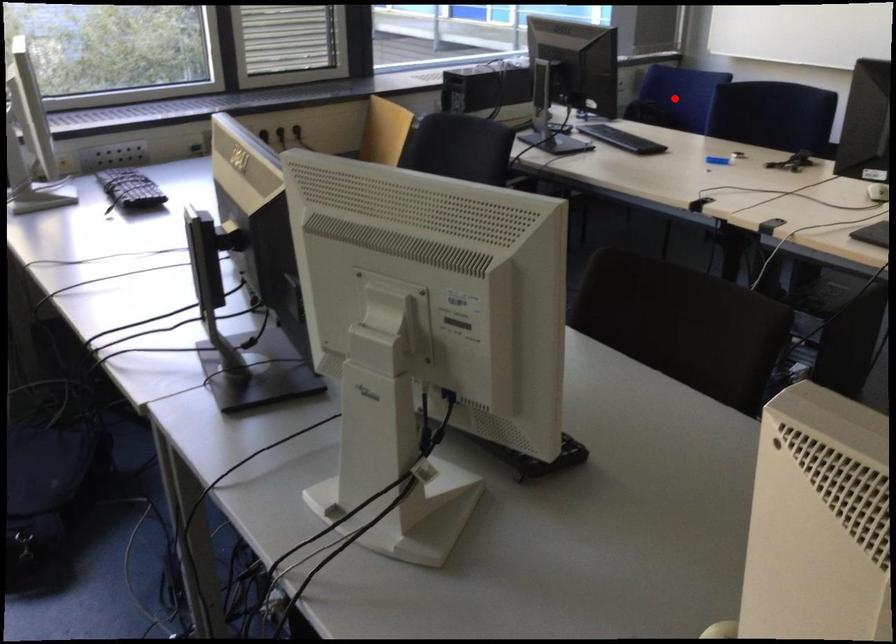
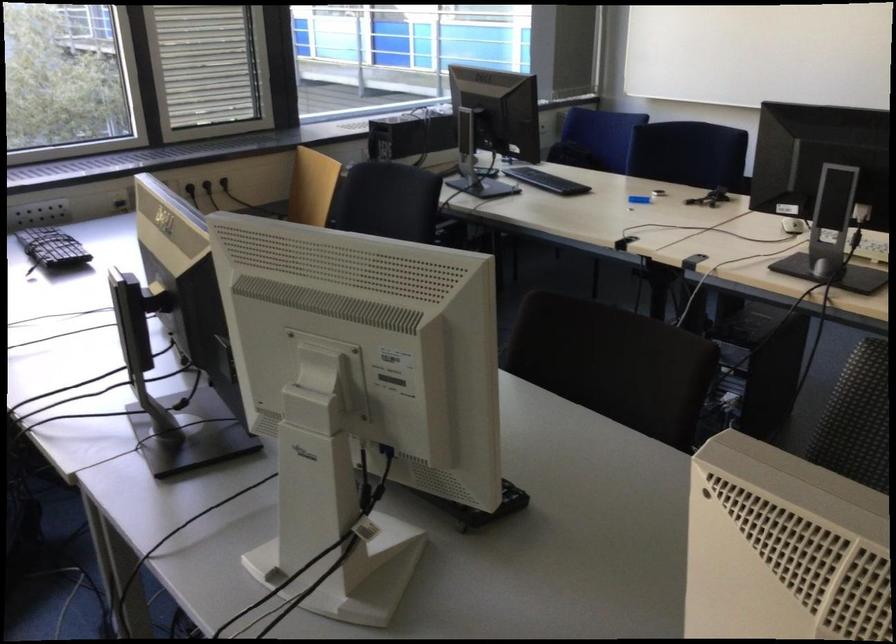
In the second image, find the point that corresponds to the highlighted location in the first image.

(596, 138)